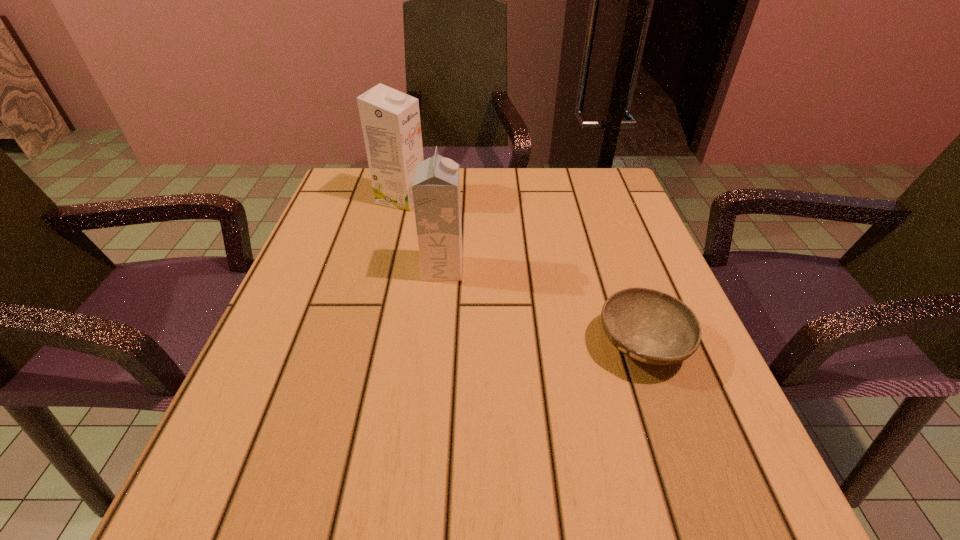
I want to click on vacant area in the image that satisfies the following two spatial constraints: 1. on the front label of the second farthest object; 2. on the back side of the shortest object, so click(436, 344).

Find the location of `free spot that satisfies the following two spatial constraints: 1. on the front label of the nearer carton; 2. on the right side of the bowl`. free spot that satisfies the following two spatial constraints: 1. on the front label of the nearer carton; 2. on the right side of the bowl is located at coordinates (436, 344).